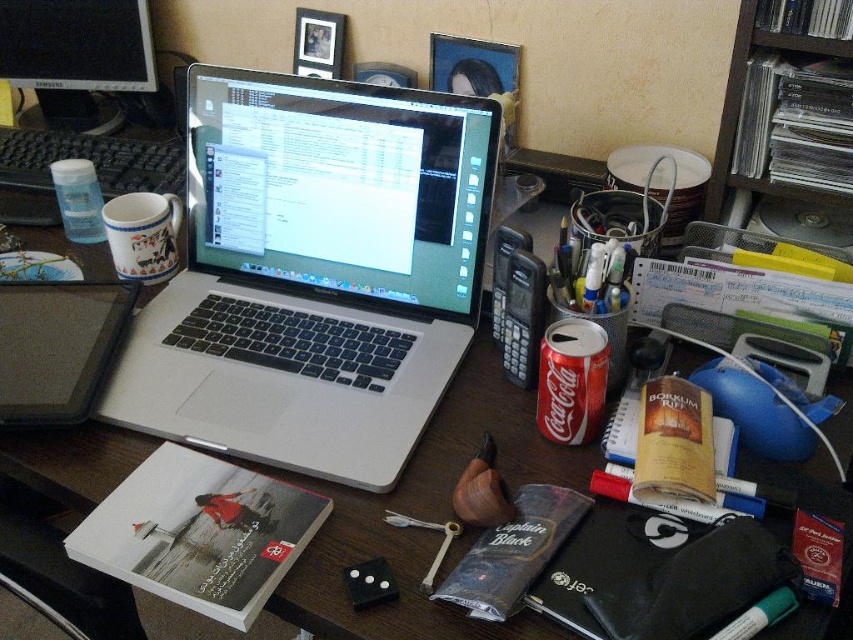
Is black glossy computer monitor at upper left to the left of white ceramic mug at left from the viewer's perspective?

Correct, you'll find black glossy computer monitor at upper left to the left of white ceramic mug at left.

Between black glossy computer monitor at upper left and white ceramic mug at left, which one is positioned higher?

black glossy computer monitor at upper left

Describe the element at coordinates (76, 54) in the screenshot. I see `black glossy computer monitor at upper left` at that location.

Locate an element on the screen. Image resolution: width=853 pixels, height=640 pixels. black glossy computer monitor at upper left is located at coordinates (76, 54).

Does black glossy computer monitor at upper left come behind black plastic case at left?

A: That is True.

Does black glossy computer monitor at upper left have a greater height compared to black plastic case at left?

Yes, black glossy computer monitor at upper left is taller than black plastic case at left.

Between point (32, 54) and point (0, 310), which one is positioned behind?

Point (32, 54)

Locate an element on the screen. black glossy computer monitor at upper left is located at coordinates click(x=76, y=54).

Does silver metallic laptop at center have a smaller size compared to white ceramic mug at left?

No.

Which is in front, point (380, 404) or point (166, 218)?

Positioned in front is point (380, 404).

Does point (186, 385) come behind point (115, 216)?

No, it is not.

The width and height of the screenshot is (853, 640). What are the coordinates of `silver metallic laptop at center` in the screenshot? It's located at (315, 273).